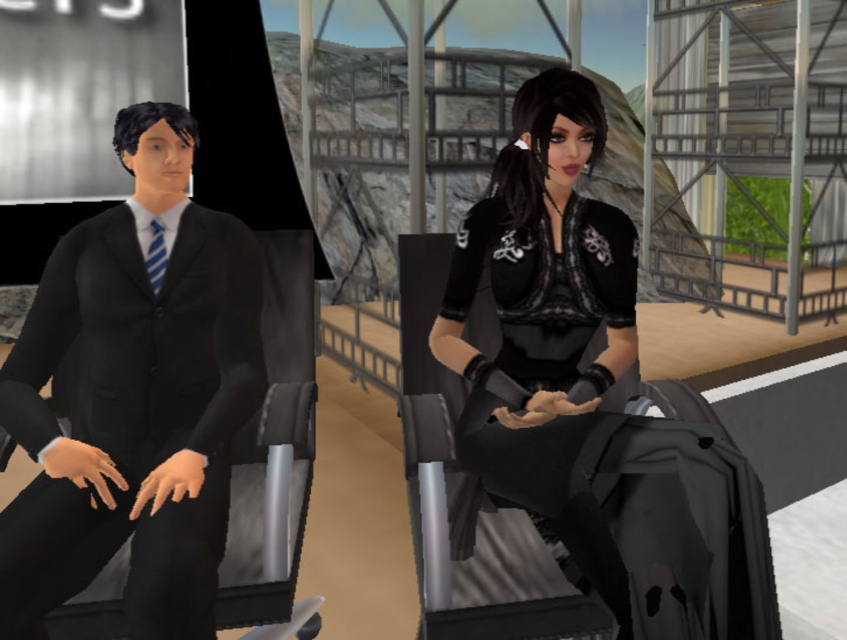
Consider the image. Who is positioned more to the right, matte black suit at left or black lace dress at center?

black lace dress at center is more to the right.

Between matte black suit at left and black lace dress at center, which one is positioned lower?

black lace dress at center is below.

Is point (189, 262) positioned before point (678, 397)?

Yes, point (189, 262) is closer to viewer.

Where is `matte black suit at left`? matte black suit at left is located at coordinates (134, 396).